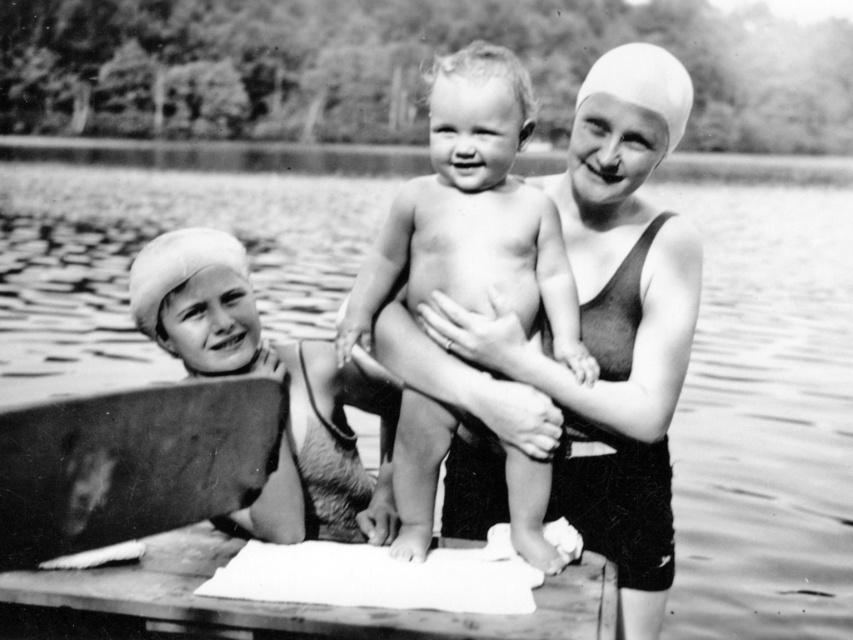
Question: Which object is closer to the camera taking this photo?

Choices:
 (A) smooth white swim cap at left
 (B) smooth skin baby at center

Answer: (B)

Question: Where is smooth skin baby at center located in relation to smooth white swim cap at left in the image?

Choices:
 (A) above
 (B) below

Answer: (A)

Question: Can you confirm if smooth skin baby at center is wider than smooth white swim cap at left?

Choices:
 (A) no
 (B) yes

Answer: (A)

Question: Which of the following is the farthest from the observer?

Choices:
 (A) (291, 488)
 (B) (537, 547)

Answer: (A)

Question: Is smooth skin baby at center smaller than smooth white swim cap at left?

Choices:
 (A) yes
 (B) no

Answer: (A)